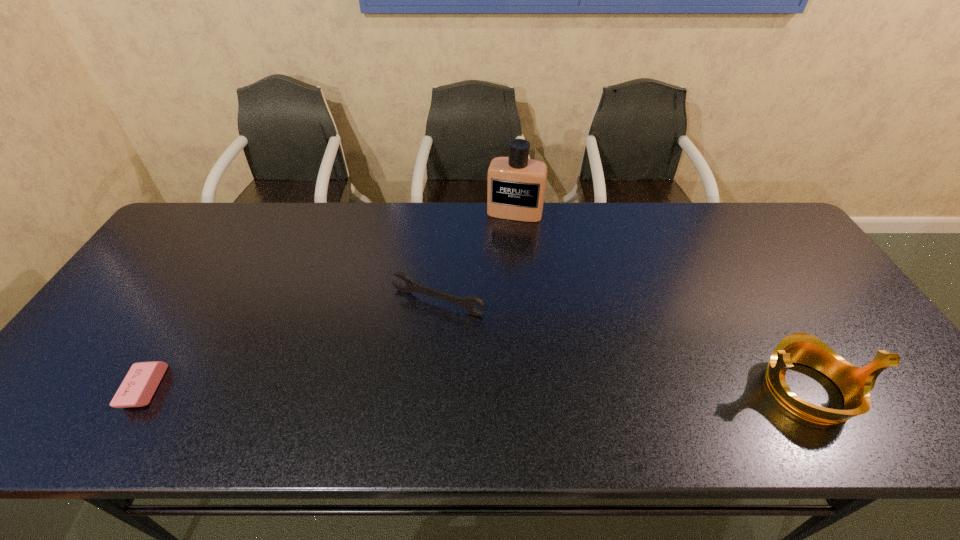
Find the location of `object at the near right corner`. object at the near right corner is located at coordinates point(855,383).

At what (x,y) coordinates should I click in order to perform the action: click on free space at the far edge of the desktop. Please return your answer as a coordinate pair (x, y). The height and width of the screenshot is (540, 960). Looking at the image, I should click on 247,239.

Locate an element on the screen. This screenshot has height=540, width=960. free space at the near edge of the desktop is located at coordinates (564, 387).

Find the location of `vacant space at the left edge of the desktop`. vacant space at the left edge of the desktop is located at coordinates (152, 323).

In the image, there is a desktop. Find the location of `vacant space at the right edge`. vacant space at the right edge is located at coordinates (864, 362).

This screenshot has width=960, height=540. In order to click on vacant area at the far right corner of the desktop in this screenshot , I will do `click(748, 204)`.

The image size is (960, 540). Identify the location of vacant space that's between the third tallest object and the tiara. (623, 346).

This screenshot has height=540, width=960. Identify the location of unoccupied position between the eraser and the tallest object. (330, 301).

Identify the location of unoccupied position between the wrench and the shortest object. (292, 346).

The image size is (960, 540). Find the location of `free area in between the leftmost object and the tiara`. free area in between the leftmost object and the tiara is located at coordinates (477, 389).